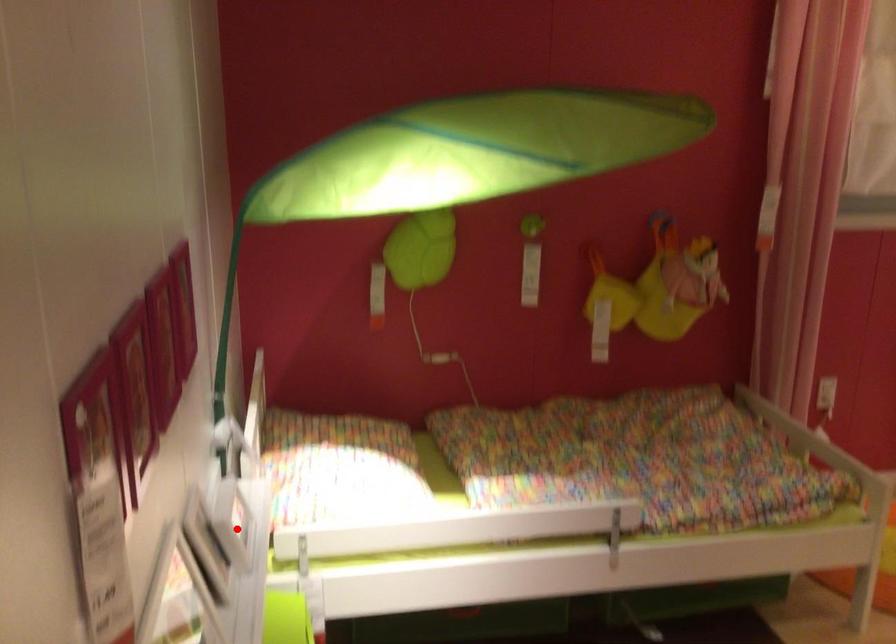
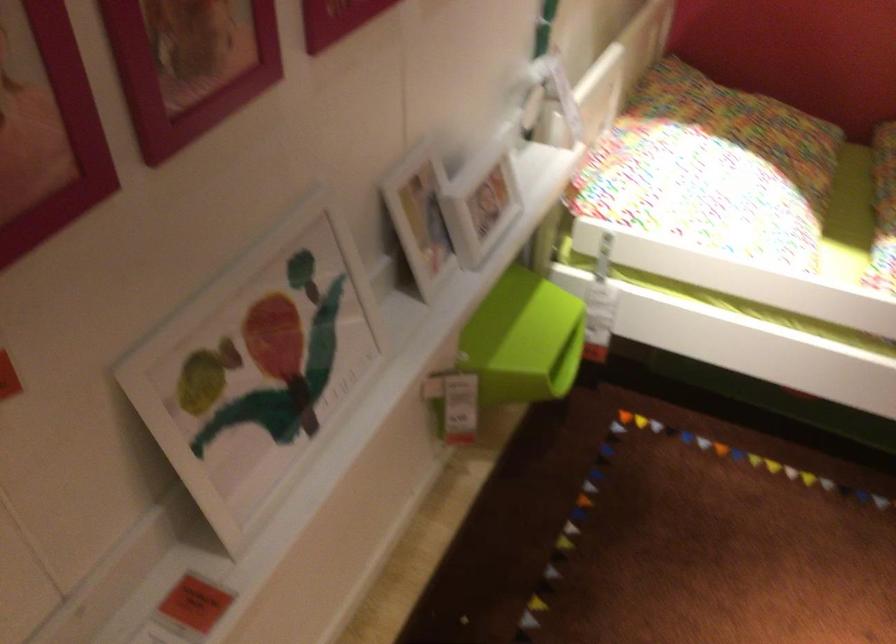
The point at the highlighted location is marked in the first image. Where is the corresponding point in the second image?

(479, 200)